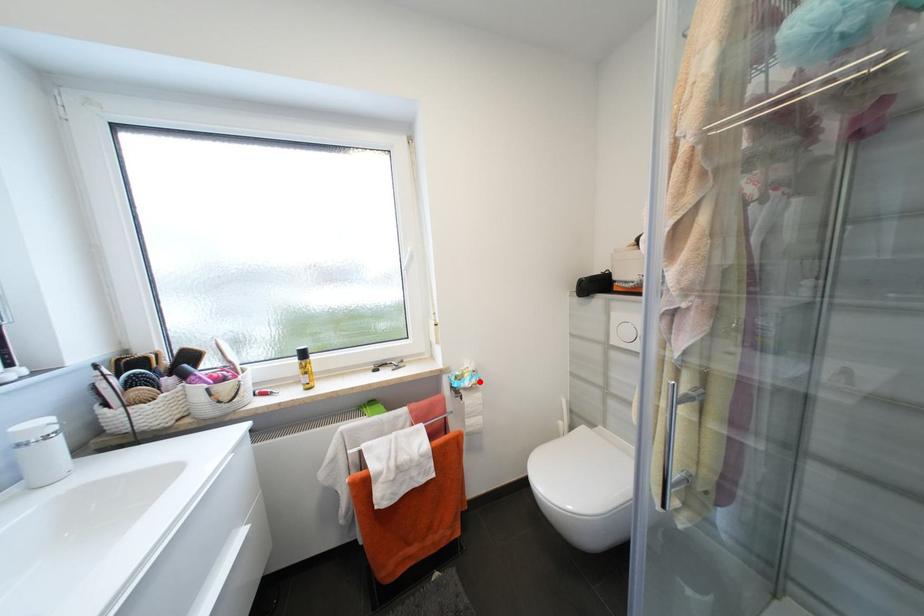
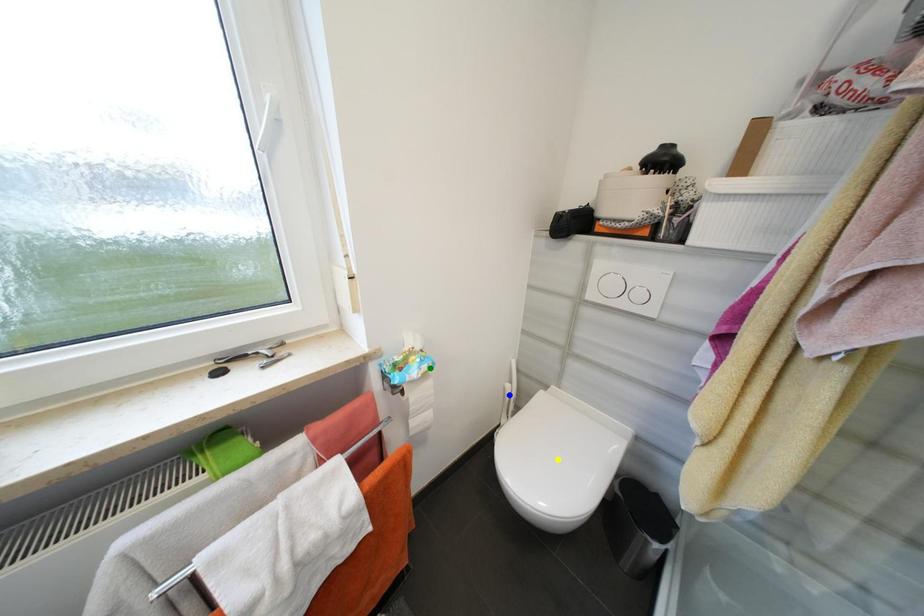
Question: I am providing you with two images of the same scene from different viewpoints. A red point is marked on the first image. You are given multiple points on the second image. Can you choose the point in image 2 that corresponds to the point in image 1?

Choices:
 (A) yellow point
 (B) green point
 (C) blue point

Answer: (B)